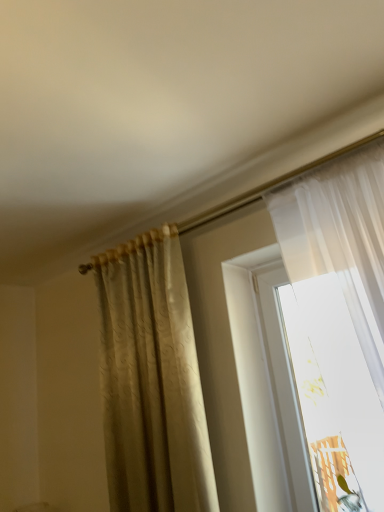
Question: Should I look upward or downward to see silky beige curtain at center?

Choices:
 (A) up
 (B) down

Answer: (B)